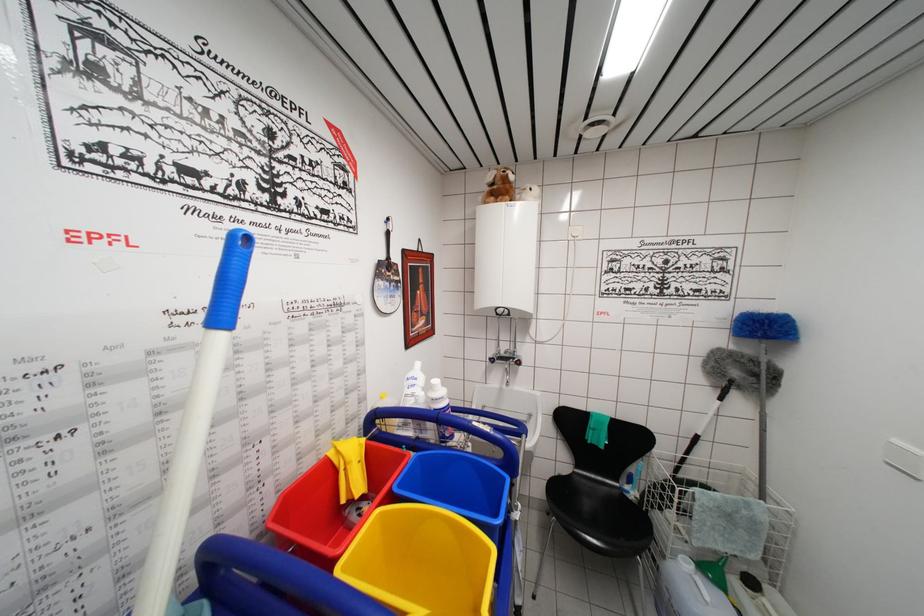
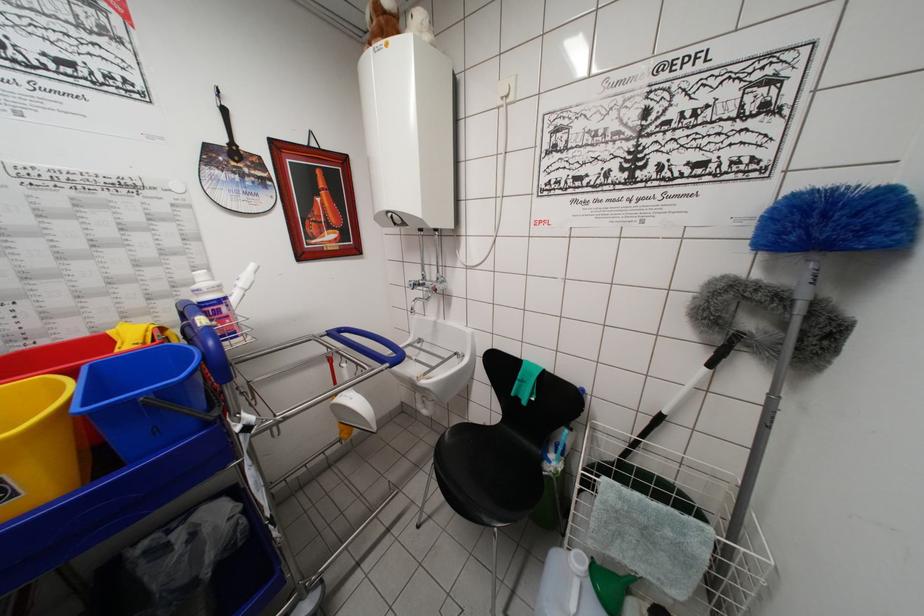
Where in the second image is the point corresponding to the point at 771,326 from the first image?

(821, 209)